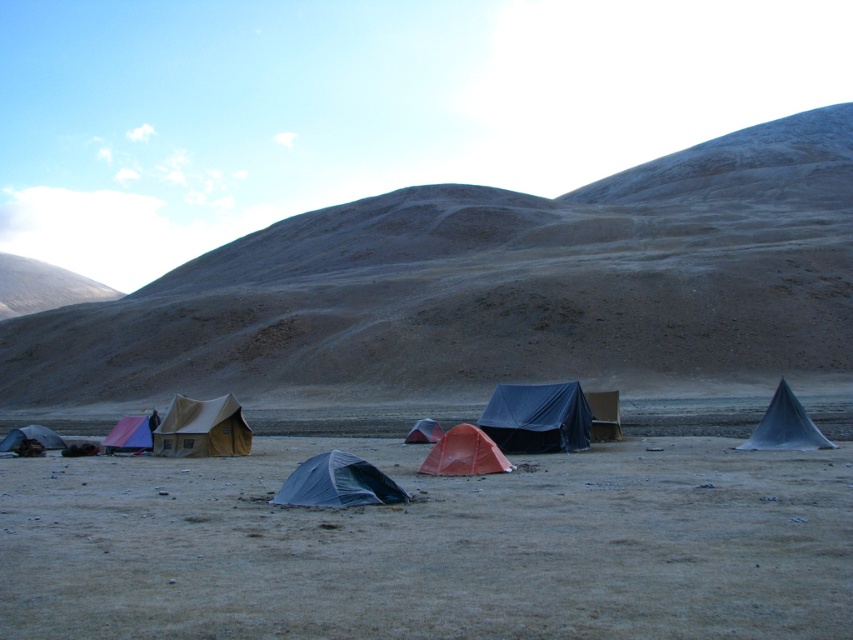
You are a hiker who needs to set up a campsite. You have a tent that requires a minimum of 15 meters of space between it and any other tents for safety. You see the black tarp tent at center and the matte beige tent at lower left. Can you place your new tent between them without violating the safety distance?

The black tarp tent at center and the matte beige tent at lower left are 16.45 meters apart from each other. Since the required minimum distance is 15 meters, placing a new tent between them would still maintain the safety distance as the existing tents are already spaced adequately apart.

You are setting up a campsite and need to know the relative positions of the tents. Which tent is positioned to the right when looking at the blue tarp tent at center and the matte beige tent at center?

The blue tarp tent at center is to the right of the matte beige tent at center.